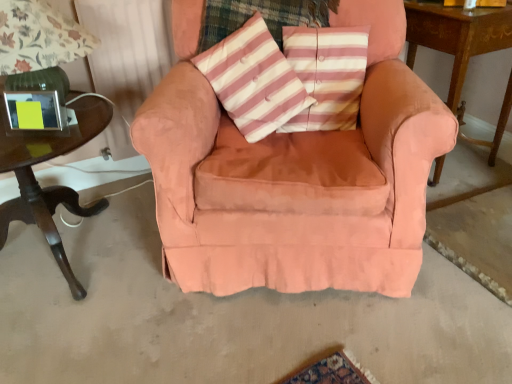
Identify the location of free spot below dark wood table at left, positioned as the second table in right-to-left order (from a real-world perspective). This screenshot has height=384, width=512. (79, 243).